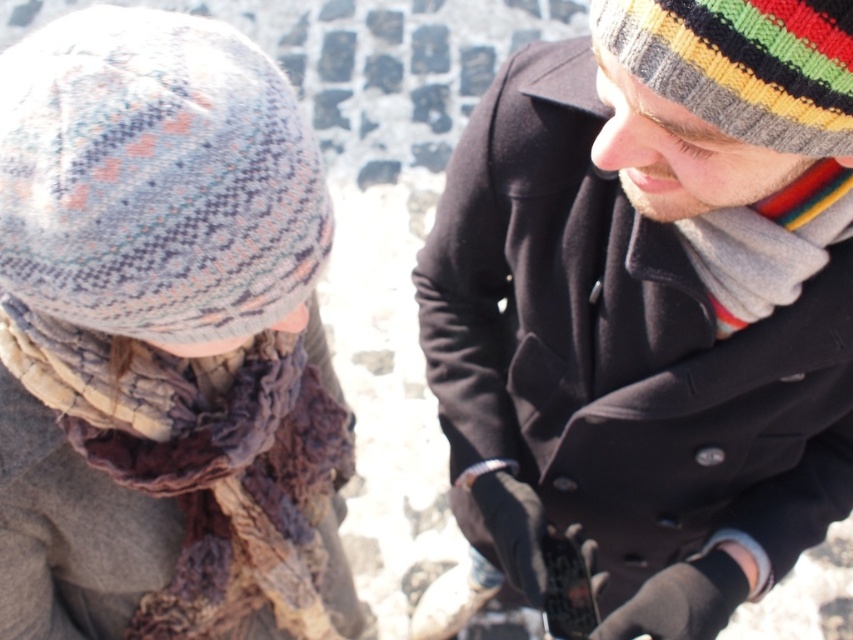
Question: Which point is farther to the camera?

Choices:
 (A) knitted wool scarf at lower left
 (B) knitted woolen hat at upper right
 (C) knitted woolen hat at upper left
 (D) black wool coat at center

Answer: (A)

Question: Is black wool coat at center behind knitted woolen hat at upper left?

Choices:
 (A) yes
 (B) no

Answer: (B)

Question: Estimate the real-world distances between objects in this image. Which object is closer to the knitted wool scarf at lower left?

Choices:
 (A) knitted woolen hat at upper left
 (B) gray knitted scarf at right
 (C) black wool coat at center

Answer: (A)

Question: Among these objects, which one is farthest from the camera?

Choices:
 (A) knitted woolen hat at upper left
 (B) black wool coat at center
 (C) gray knitted scarf at right

Answer: (C)

Question: Does knitted woolen hat at upper left have a lesser width compared to knitted woolen hat at upper right?

Choices:
 (A) no
 (B) yes

Answer: (A)

Question: Considering the relative positions of black wool coat at center and knitted wool scarf at lower left in the image provided, where is black wool coat at center located with respect to knitted wool scarf at lower left?

Choices:
 (A) above
 (B) below

Answer: (A)